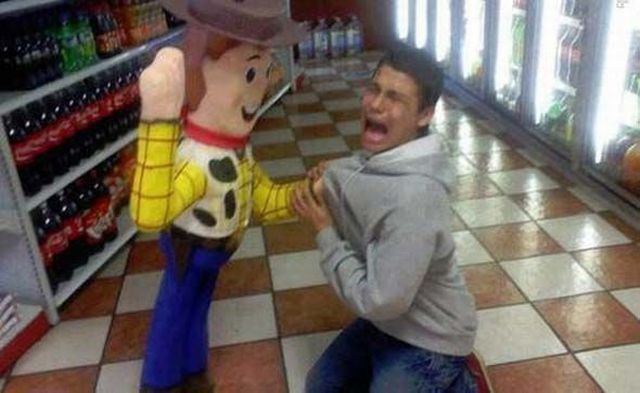
Image resolution: width=640 pixels, height=393 pixels. Find the location of `fridge`. fridge is located at coordinates (403, 31), (418, 31), (445, 39), (480, 48), (508, 59), (540, 81), (610, 141).